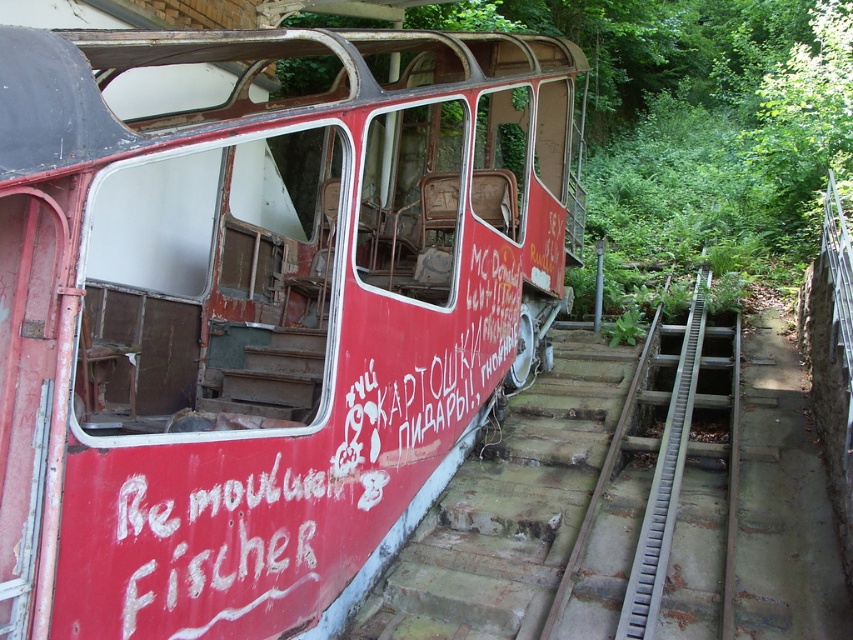
Question: In this image, where is rusty metal train at center located relative to metallic gray rail at right?

Choices:
 (A) left
 (B) right

Answer: (A)

Question: Among these points, which one is nearest to the camera?

Choices:
 (A) (498, 444)
 (B) (22, 68)
 (C) (637, 484)
 (D) (677, 358)

Answer: (B)

Question: Which of the following is the closest to the observer?

Choices:
 (A) click(x=663, y=513)
 (B) click(x=599, y=385)
 (C) click(x=103, y=497)

Answer: (C)

Question: Can you confirm if rusty metal train at center is positioned below metallic gray rail at right?

Choices:
 (A) yes
 (B) no

Answer: (B)

Question: Among these objects, which one is farthest from the camera?

Choices:
 (A) metallic gray rail at right
 (B) rusty metal train at center
 (C) gray metallic train track at center

Answer: (B)

Question: In this image, where is rusty metal train at center located relative to concrete stairs at center?

Choices:
 (A) below
 (B) above

Answer: (B)